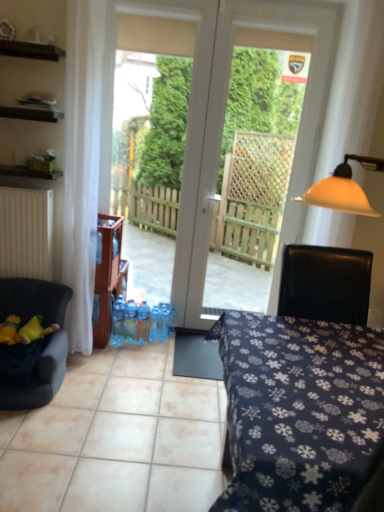
Question: Is wooden cabinet at upper left, the second cabinetry positioned from the bottom, taller or shorter than yellow plush toy at left, the 1th toy when ordered from right to left?

Choices:
 (A) tall
 (B) short

Answer: (B)

Question: Considering their positions, is wooden cabinet at upper left, the second cabinetry positioned from the bottom, located in front of or behind yellow plush toy at left, the 1th toy when ordered from right to left?

Choices:
 (A) front
 (B) behind

Answer: (A)

Question: Which is farther from the velvet dark blue chair at left?

Choices:
 (A) wooden cabinet at upper left, the second cabinetry positioned from the bottom
 (B) dark blue fabric table at center
 (C) blue plastic bottle at center, the fourth bottle positioned from the right
 (D) blue plastic bottle at center, the third bottle in the right-to-left sequence
 (E) blue plastic bottle at center, the 1th bottle in the right-to-left sequence

Answer: (B)

Question: Estimate the real-world distances between objects in this image. Which object is farther from the yellow fabric toy at lower left, positioned as the 1th toy in left-to-right order?

Choices:
 (A) dark blue fabric table at center
 (B) blue plastic bottle at center, the third bottle in the right-to-left sequence
 (C) blue plastic bottle at center, which is the 2th bottle from right to left
 (D) clear plastic bottles at center, the fifth bottle from the right
 (E) white glossy door at center

Answer: (E)